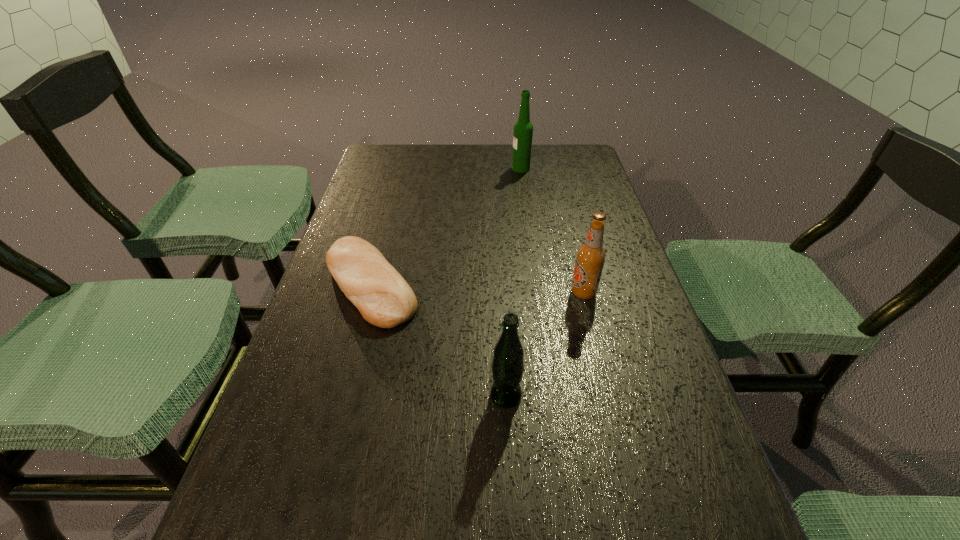
Locate an element on the screen. The height and width of the screenshot is (540, 960). blank space located 0.360m on the label of the farthest beer bottle is located at coordinates (403, 168).

At what (x,y) coordinates should I click in order to perform the action: click on free space located 0.190m on the front label of the second nearest beer bottle. Please return your answer as a coordinate pair (x, y). Looking at the image, I should click on (488, 292).

I want to click on vacant area located 0.110m on the front label of the second nearest beer bottle, so click(522, 292).

Where is `free region located 0.340m on the front label of the second nearest beer bottle`? This screenshot has width=960, height=540. free region located 0.340m on the front label of the second nearest beer bottle is located at coordinates (423, 292).

I want to click on vacant space located 0.160m on the back of the nearest beer bottle, so click(x=502, y=320).

Where is `free spot located on the right of the bread`? This screenshot has height=540, width=960. free spot located on the right of the bread is located at coordinates (486, 285).

This screenshot has height=540, width=960. Find the location of `object that is at the far edge`. object that is at the far edge is located at coordinates (523, 129).

At what (x,y) coordinates should I click in order to perform the action: click on object that is at the left edge. Please return your answer as a coordinate pair (x, y). This screenshot has width=960, height=540. Looking at the image, I should click on (383, 297).

I want to click on object located at the right edge, so click(590, 257).

Where is `blank space at the far edge of the desktop`? This screenshot has height=540, width=960. blank space at the far edge of the desktop is located at coordinates click(x=476, y=165).